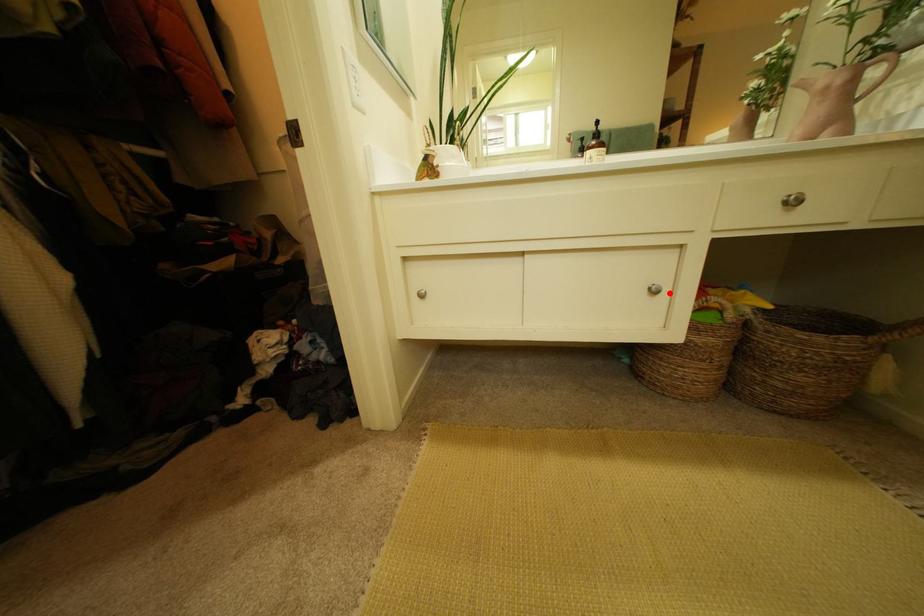
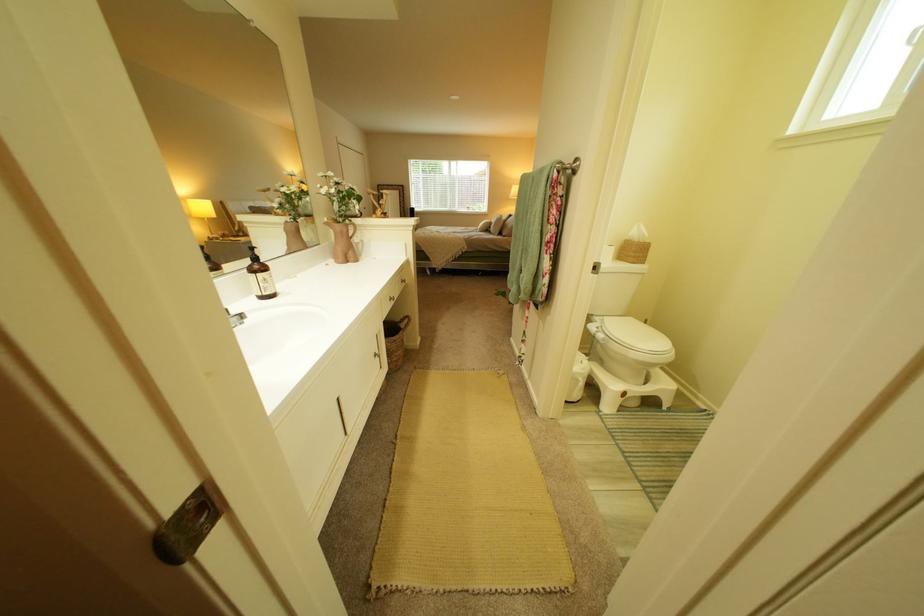
Question: A red point is marked in image1. In image2, is the corresponding 3D point closer to the camera or farther? Reply with the corresponding letter.

Choices:
 (A) The corresponding 3D point is closer.
 (B) The corresponding 3D point is farther.

Answer: (A)